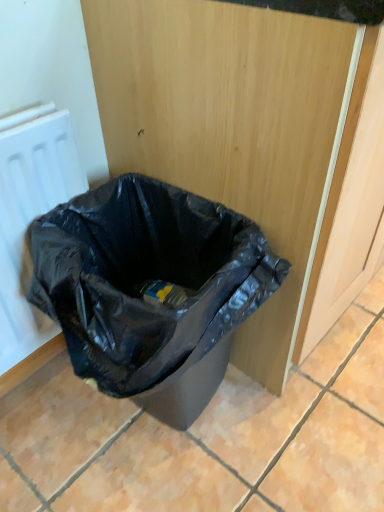
Question: Does black plastic bag at lower left have a smaller size compared to white matte radiator at left?

Choices:
 (A) no
 (B) yes

Answer: (A)

Question: From the image's perspective, does black plastic bag at lower left appear lower than white matte radiator at left?

Choices:
 (A) no
 (B) yes

Answer: (B)

Question: Can you confirm if black plastic bag at lower left is thinner than white matte radiator at left?

Choices:
 (A) no
 (B) yes

Answer: (A)

Question: Does black plastic bag at lower left have a larger size compared to white matte radiator at left?

Choices:
 (A) yes
 (B) no

Answer: (A)

Question: Is black plastic bag at lower left at the right side of white matte radiator at left?

Choices:
 (A) no
 (B) yes

Answer: (B)

Question: Is black plastic bag at lower left positioned behind white matte radiator at left?

Choices:
 (A) no
 (B) yes

Answer: (A)

Question: From a real-world perspective, is white matte radiator at left positioned over black plastic bag at lower left based on gravity?

Choices:
 (A) yes
 (B) no

Answer: (A)

Question: Is white matte radiator at left further to the viewer compared to black plastic bag at lower left?

Choices:
 (A) no
 (B) yes

Answer: (B)

Question: Can you confirm if white matte radiator at left is smaller than black plastic bag at lower left?

Choices:
 (A) yes
 (B) no

Answer: (A)

Question: Can you confirm if white matte radiator at left is wider than black plastic bag at lower left?

Choices:
 (A) no
 (B) yes

Answer: (A)

Question: From the image's perspective, is white matte radiator at left on top of black plastic bag at lower left?

Choices:
 (A) no
 (B) yes

Answer: (B)

Question: Can we say white matte radiator at left lies outside black plastic bag at lower left?

Choices:
 (A) no
 (B) yes

Answer: (B)

Question: Is white matte radiator at left inside the boundaries of black plastic bag at lower left, or outside?

Choices:
 (A) inside
 (B) outside

Answer: (B)